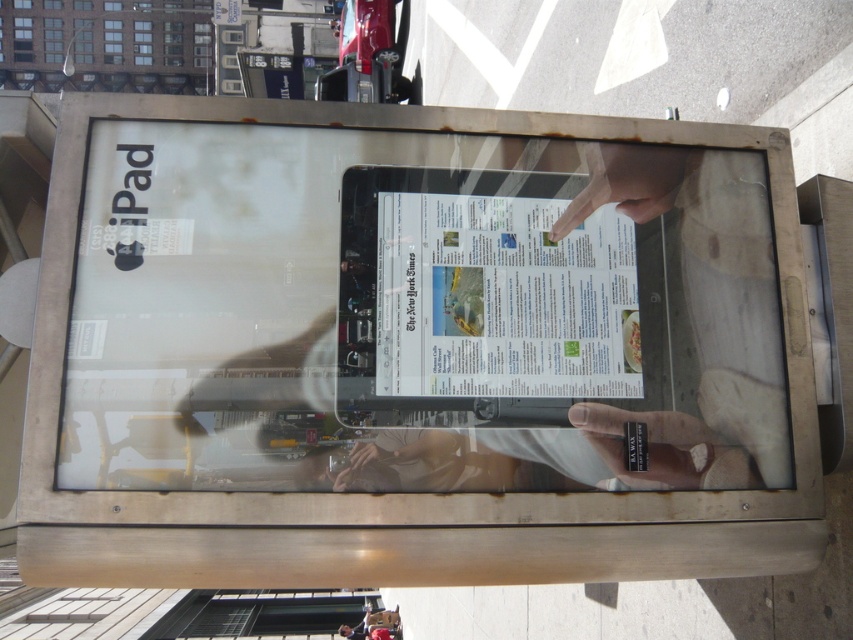
Question: Among these points, which one is farthest from the camera?

Choices:
 (A) (660, 164)
 (B) (798, 296)
 (C) (440, 460)
 (D) (625, 474)

Answer: (A)

Question: Is silver metallic tablet at center positioned at the back of smooth skin hand at center?

Choices:
 (A) no
 (B) yes

Answer: (A)

Question: In this image, where is silver metallic tablet at center located relative to smooth skin hand at lower center?

Choices:
 (A) above
 (B) below

Answer: (A)

Question: Which of the following is the farthest from the observer?

Choices:
 (A) (671, 460)
 (B) (599, 150)
 (C) (297, 285)

Answer: (B)

Question: Is silver metallic tablet at center below smooth skin hand at center?

Choices:
 (A) yes
 (B) no

Answer: (A)

Question: Which point is farther to the camera?

Choices:
 (A) (619, 440)
 (B) (566, 468)

Answer: (A)